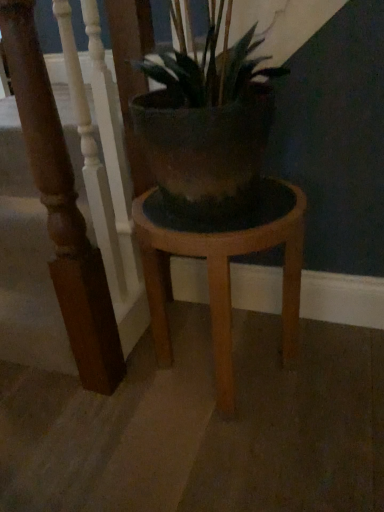
Identify the location of vacant space underneath wooden stool at center (from a real-world perspective). This screenshot has height=512, width=384. coord(233,360).